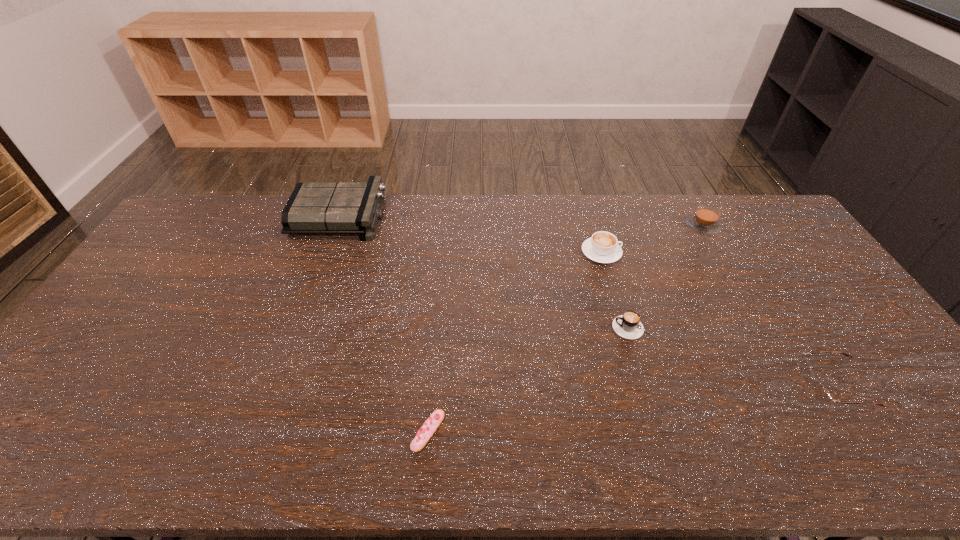
The image size is (960, 540). In order to click on free space located on the side of the second farthest cappuccino with the handle in this screenshot , I will do `click(690, 252)`.

Find the location of `free space located 0.130m with the handle on the side of the fourth farthest object`. free space located 0.130m with the handle on the side of the fourth farthest object is located at coordinates (566, 328).

This screenshot has width=960, height=540. What are the coordinates of `blank area located with the handle on the side of the fourth farthest object` in the screenshot? It's located at (538, 328).

Identify the location of free spot located with the handle on the side of the fourth farthest object. Image resolution: width=960 pixels, height=540 pixels. (498, 328).

Find the location of a particular element. The height and width of the screenshot is (540, 960). vacant space located on the front-facing side of the spectacles is located at coordinates (773, 386).

Locate an element on the screen. vacant space located on the front-facing side of the spectacles is located at coordinates (761, 386).

Image resolution: width=960 pixels, height=540 pixels. What are the coordinates of `free location located on the front-facing side of the spectacles` in the screenshot? It's located at (745, 386).

Identify the location of vacant space located 0.290m on the left of the shortest object. (288, 431).

You are a GUI agent. You are given a task and a screenshot of the screen. Output one action in this format:
    pyautogui.click(x=<x>, y=<y>)
    Task: Click on the radio receiver that is at the far edge
    Image resolution: width=960 pixels, height=540 pixels.
    Given the screenshot: What is the action you would take?
    pyautogui.click(x=313, y=208)

Locate an element on the screen. This screenshot has width=960, height=540. cappuccino present at the far edge is located at coordinates (705, 220).